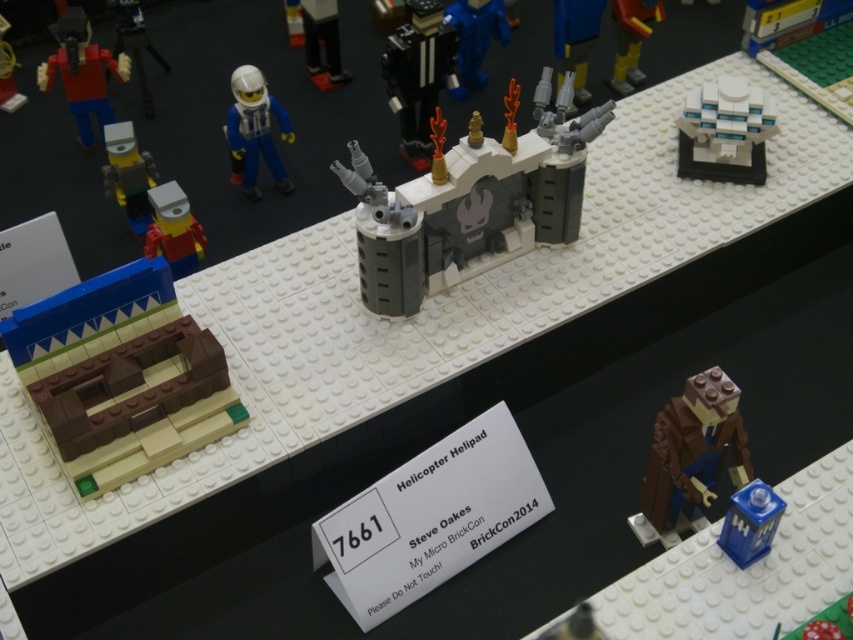
Does matte yellow minifigure at left come in front of yellow matte boots at upper right?

Yes, matte yellow minifigure at left is closer to the viewer.

How distant is matte yellow minifigure at left from yellow matte boots at upper right?

matte yellow minifigure at left and yellow matte boots at upper right are 3.57 feet apart.

Describe the element at coordinates (128, 176) in the screenshot. The image size is (853, 640). I see `matte yellow minifigure at left` at that location.

Find the location of `matte yellow minifigure at left`. matte yellow minifigure at left is located at coordinates (128, 176).

Which is below, blue plastic tardis at lower right or yellow matte boots at upper right?

blue plastic tardis at lower right is lower down.

Does blue plastic tardis at lower right appear on the right side of yellow matte boots at upper right?

In fact, blue plastic tardis at lower right is to the left of yellow matte boots at upper right.

Between point (750, 547) and point (621, 49), which one is positioned in front?

Point (750, 547)

This screenshot has width=853, height=640. I want to click on blue plastic tardis at lower right, so click(x=750, y=522).

Is matte white plastic astronaut at upper center thinner than blue plastic tardis at lower right?

In fact, matte white plastic astronaut at upper center might be wider than blue plastic tardis at lower right.

Looking at this image, which is more to the left, matte white plastic astronaut at upper center or blue plastic tardis at lower right?

matte white plastic astronaut at upper center is more to the left.

You are a GUI agent. You are given a task and a screenshot of the screen. Output one action in this format:
    pyautogui.click(x=<x>, y=<y>)
    Task: Click on the matte white plastic astronaut at upper center
    
    Given the screenshot: What is the action you would take?
    pyautogui.click(x=254, y=131)

Locate an element on the screen. Image resolution: width=853 pixels, height=640 pixels. matte white plastic astronaut at upper center is located at coordinates (254, 131).